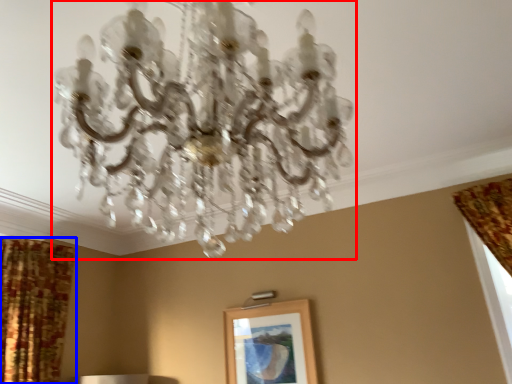
Question: Which of the following is the farthest to the observer, lamp (highlighted by a red box) or curtain (highlighted by a blue box)?

Choices:
 (A) lamp
 (B) curtain

Answer: (B)